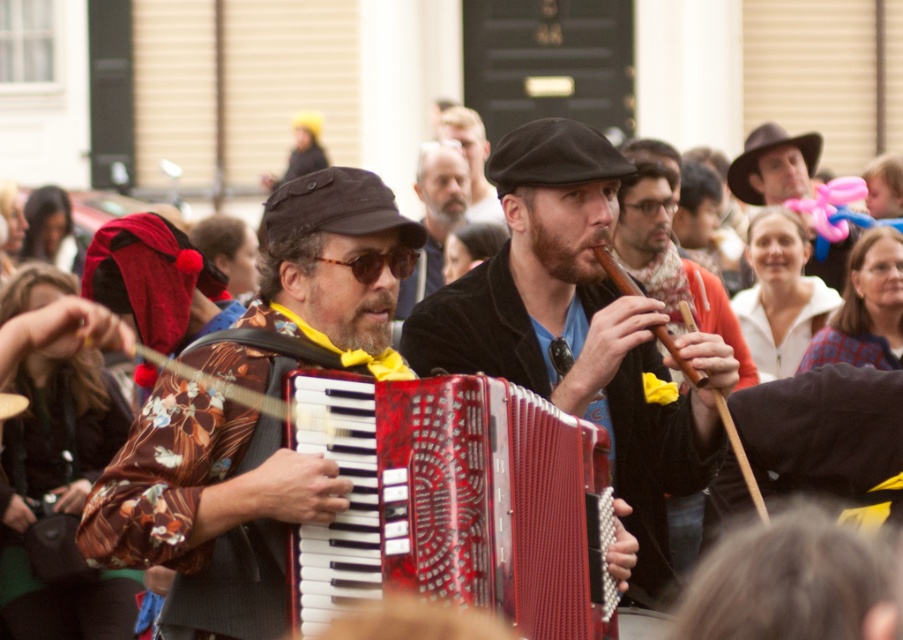
You are standing at the center of the street and see two points marked in the scene. The first point is at position point [538,164] and the second point is at position point [475,116]. If you want to walk towards the point that is closer to you, which point should you head towards?

Point [538,164] is in front of point [475,116], so the point closer to you is point [538,164].

You are a photographer trying to capture the shiny red accordion at center and the matte black accordion at center in a single shot. Since both are in the same area, which one will appear larger in your photo?

The shiny red accordion at center appears larger because it is positioned in front of the matte black accordion at center, making it closer to the camera.

You are a street performer who just finished a show. You need to carry both the shiny red accordion at center and the matte black accordion at center to your car parked nearby. Which accordion should you grab first if you want to pick up the one closer to your right side?

The shiny red accordion at center is to the left of matte black accordion at center, so the matte black accordion at center is closer to your right side. You should grab the matte black accordion at center first.